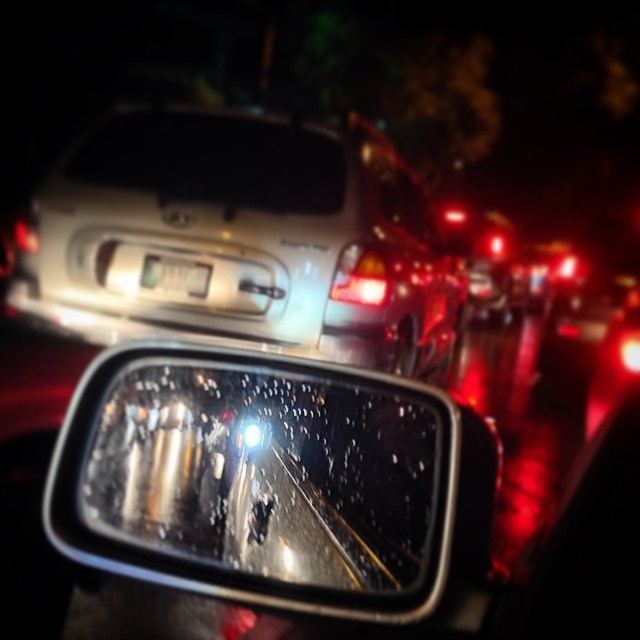
Question: From the image, what is the correct spatial relationship of transparent glass at upper center in relation to white plastic license plate at center?

Choices:
 (A) right
 (B) left

Answer: (A)

Question: Which point is closer to the camera?

Choices:
 (A) white plastic license plate at center
 (B) transparent glass at upper center

Answer: (B)

Question: Which of the following is the farthest from the observer?

Choices:
 (A) satin silver sedan at upper center
 (B) clear glass mirror at center
 (C) matte plastic headlight at upper center
 (D) white plastic license plate at center

Answer: (D)

Question: Does transparent glass at upper center come in front of matte plastic headlight at upper center?

Choices:
 (A) no
 (B) yes

Answer: (B)

Question: Is transparent glass at upper center above white plastic license plate at center?

Choices:
 (A) no
 (B) yes

Answer: (B)

Question: Which point is closer to the camera taking this photo?

Choices:
 (A) (209, 273)
 (B) (136, 125)
 (C) (52, 536)

Answer: (C)